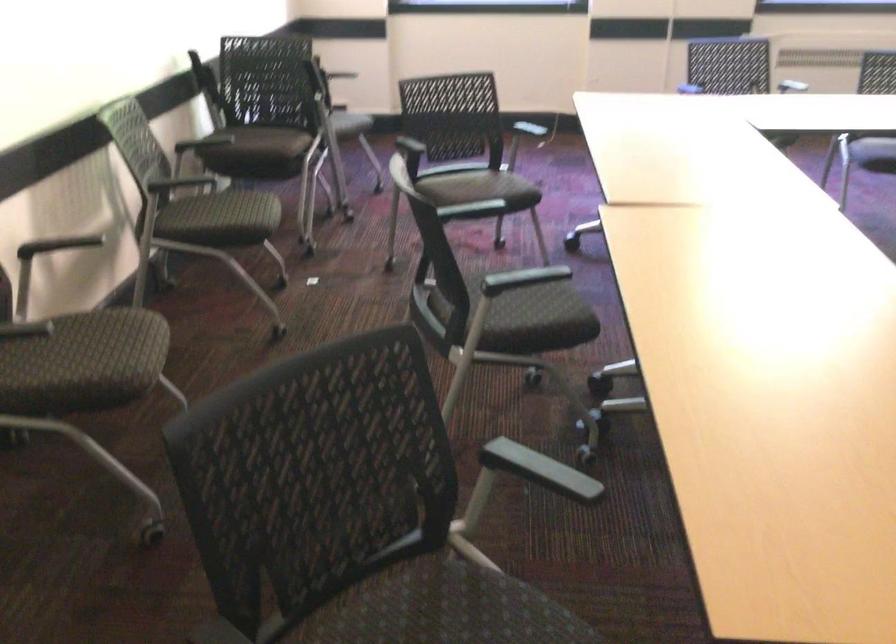
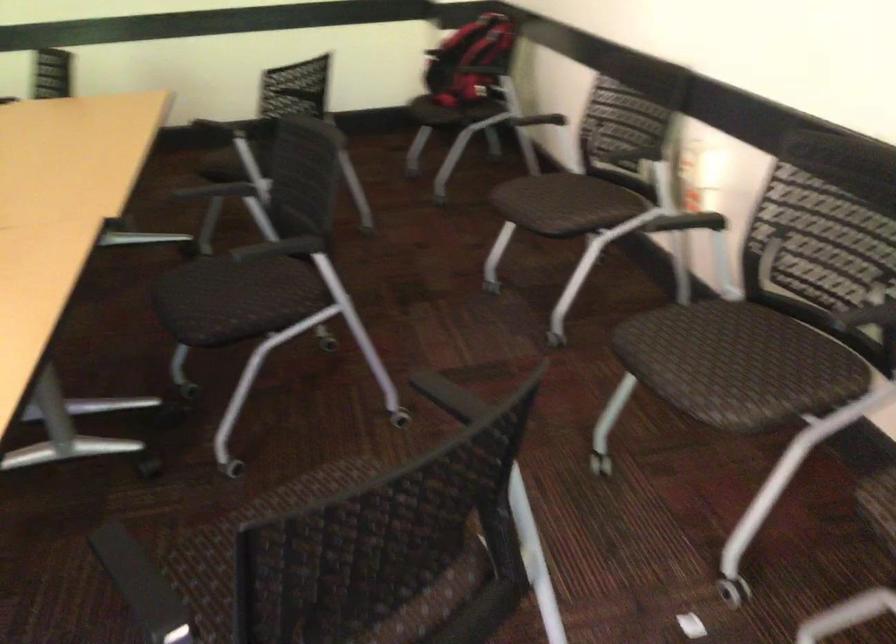
In the second image, find the point that corresponds to [486,203] in the first image.

(313, 487)